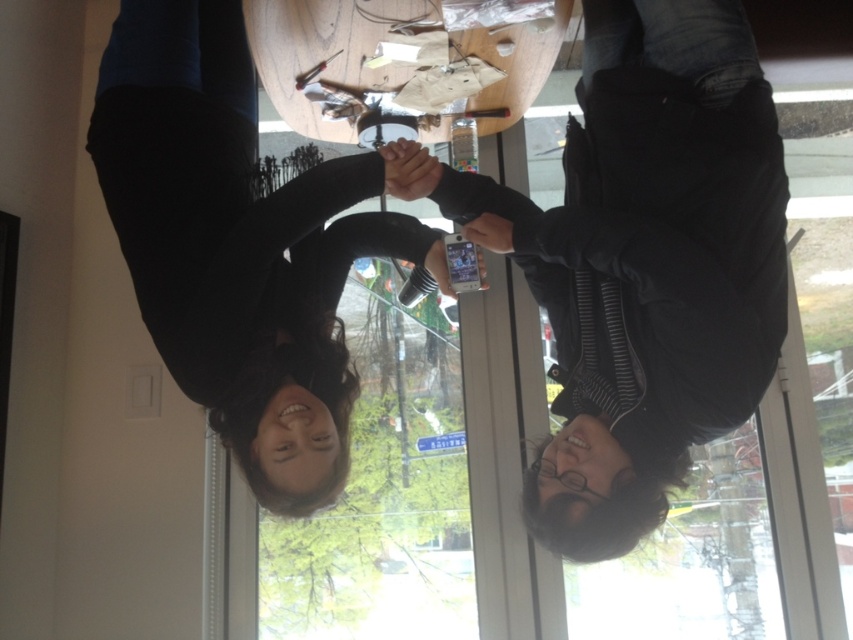
You are a photographer trying to capture a candid shot of the two people at the round wooden table. You notice the matte black phone at center and the black matte hair at upper center in your frame. Which object appears taller in the photo?

The matte black phone at center appears taller in the photo because it has a greater height compared to the black matte hair at upper center.

In the scene shown: You are trying to determine if the matte black phone at center can fit into a pocket designed for items the size of the black matte hair at upper center. Based on their sizes, can the phone fit?

The matte black phone at center is smaller than the black matte hair at upper center, so it can fit into a pocket designed for the size of the black matte hair at upper center.

You are a photographer trying to capture a candid shot of the two people at the round wooden table. You notice the matte black phone at center and the black matte hair at upper center. Which object is closer to the camera?

The matte black phone at center is closer to the camera because it is in front of the black matte hair at upper center.